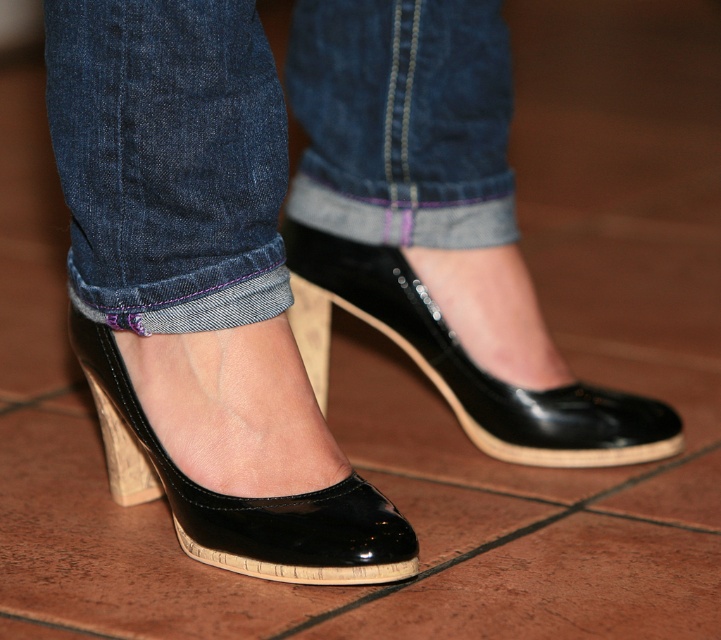
Based on the photo, between denim at lower center and glossy patent leather shoe at lower center, which one appears on the left side from the viewer's perspective?

glossy patent leather shoe at lower center

Does denim at lower center appear over glossy patent leather shoe at lower center?

Yes.

Locate an element on the screen. This screenshot has height=640, width=721. denim at lower center is located at coordinates (168, 161).

Find the location of a particular element. denim at lower center is located at coordinates (168, 161).

Can you confirm if glossy patent leather shoe at center is bigger than glossy patent leather shoe at lower center?

Indeed, glossy patent leather shoe at center has a larger size compared to glossy patent leather shoe at lower center.

Is glossy patent leather shoe at center to the left of glossy patent leather shoe at lower center from the viewer's perspective?

No, glossy patent leather shoe at center is not to the left of glossy patent leather shoe at lower center.

This screenshot has height=640, width=721. What do you see at coordinates (461, 362) in the screenshot? I see `glossy patent leather shoe at center` at bounding box center [461, 362].

Identify the location of glossy patent leather shoe at center. The image size is (721, 640). (461, 362).

Describe the element at coordinates (168, 161) in the screenshot. I see `denim at lower center` at that location.

Who is positioned more to the left, denim at lower center or glossy patent leather shoe at center?

Positioned to the left is denim at lower center.

Is point (375, 58) positioned before point (552, 449)?

Yes, it is.

Where is `denim at lower center`? The image size is (721, 640). denim at lower center is located at coordinates (168, 161).